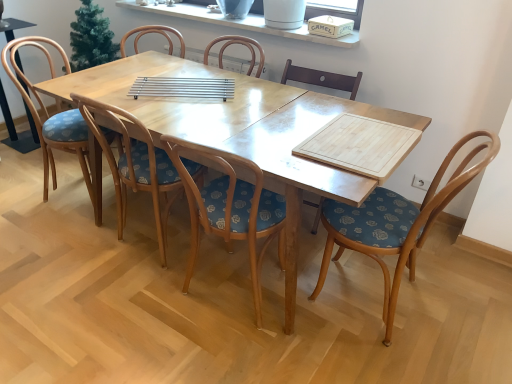
Find the location of a particular element. The width and height of the screenshot is (512, 384). vacant space situated on the left part of wooden chair with floral upholstery at center, the 3th chair in the left-to-right sequence is located at coordinates (124, 312).